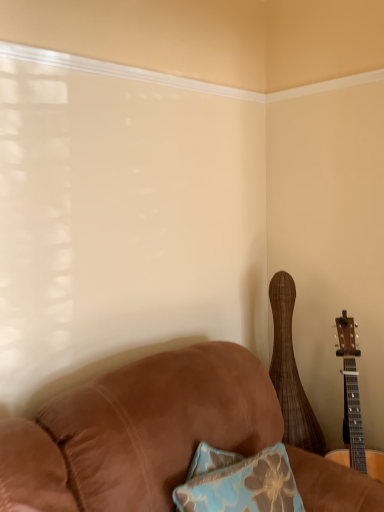
The width and height of the screenshot is (384, 512). What do you see at coordinates (290, 371) in the screenshot? I see `wooden acoustic guitar at right, which appears as the first guitar when viewed from the left` at bounding box center [290, 371].

This screenshot has width=384, height=512. I want to click on wooden acoustic guitar at right, which is the second guitar from right to left, so click(x=290, y=371).

In order to click on natural wood acoustic guitar at right, marked as the 1th guitar in a right-to-left arrangement in this screenshot , I will do `click(353, 407)`.

In order to face natural wood acoustic guitar at right, marked as the 1th guitar in a right-to-left arrangement, should I rotate leftwards or rightwards?

It's best to rotate right around 21.680 degrees.

The height and width of the screenshot is (512, 384). What do you see at coordinates (353, 407) in the screenshot? I see `natural wood acoustic guitar at right, positioned as the 2th guitar in left-to-right order` at bounding box center [353, 407].

Locate an element on the screen. wooden acoustic guitar at right, which is the second guitar from right to left is located at coordinates click(290, 371).

Can you confirm if wooden acoustic guitar at right, which appears as the first guitar when viewed from the left, is positioned to the left of natural wood acoustic guitar at right, positioned as the 2th guitar in left-to-right order?

Yes, wooden acoustic guitar at right, which appears as the first guitar when viewed from the left, is to the left of natural wood acoustic guitar at right, positioned as the 2th guitar in left-to-right order.

From the picture: Between wooden acoustic guitar at right, which appears as the first guitar when viewed from the left, and natural wood acoustic guitar at right, marked as the 1th guitar in a right-to-left arrangement, which one is positioned behind?

wooden acoustic guitar at right, which appears as the first guitar when viewed from the left.

Does point (275, 379) come farther from viewer compared to point (379, 472)?

Yes.

From the image's perspective, is wooden acoustic guitar at right, which is the second guitar from right to left, on top of natural wood acoustic guitar at right, positioned as the 2th guitar in left-to-right order?

Yes, from the image's perspective, wooden acoustic guitar at right, which is the second guitar from right to left, is above natural wood acoustic guitar at right, positioned as the 2th guitar in left-to-right order.

From a real-world perspective, is wooden acoustic guitar at right, which is the second guitar from right to left, on natural wood acoustic guitar at right, positioned as the 2th guitar in left-to-right order?

Yes, from a real-world perspective, wooden acoustic guitar at right, which is the second guitar from right to left, is on top of natural wood acoustic guitar at right, positioned as the 2th guitar in left-to-right order.

Can you confirm if wooden acoustic guitar at right, which is the second guitar from right to left, is wider than natural wood acoustic guitar at right, positioned as the 2th guitar in left-to-right order?

Incorrect, the width of wooden acoustic guitar at right, which is the second guitar from right to left, does not surpass that of natural wood acoustic guitar at right, positioned as the 2th guitar in left-to-right order.

Consider the image. Which of these two, wooden acoustic guitar at right, which is the second guitar from right to left, or natural wood acoustic guitar at right, positioned as the 2th guitar in left-to-right order, stands taller?

wooden acoustic guitar at right, which is the second guitar from right to left, is taller.

Is wooden acoustic guitar at right, which appears as the first guitar when viewed from the left, smaller than natural wood acoustic guitar at right, marked as the 1th guitar in a right-to-left arrangement?

Yes.

Could natural wood acoustic guitar at right, positioned as the 2th guitar in left-to-right order, be considered to be inside wooden acoustic guitar at right, which appears as the first guitar when viewed from the left?

Actually, natural wood acoustic guitar at right, positioned as the 2th guitar in left-to-right order, is outside wooden acoustic guitar at right, which appears as the first guitar when viewed from the left.

Is wooden acoustic guitar at right, which is the second guitar from right to left, beside natural wood acoustic guitar at right, marked as the 1th guitar in a right-to-left arrangement?

wooden acoustic guitar at right, which is the second guitar from right to left, and natural wood acoustic guitar at right, marked as the 1th guitar in a right-to-left arrangement, are clearly separated.

Based on the photo, is wooden acoustic guitar at right, which appears as the first guitar when viewed from the left, facing away from natural wood acoustic guitar at right, marked as the 1th guitar in a right-to-left arrangement?

Yes, natural wood acoustic guitar at right, marked as the 1th guitar in a right-to-left arrangement, is at the back of wooden acoustic guitar at right, which appears as the first guitar when viewed from the left.

This screenshot has width=384, height=512. In order to click on guitar to the left of natural wood acoustic guitar at right, marked as the 1th guitar in a right-to-left arrangement in this screenshot , I will do [x=290, y=371].

Which is more to the left, natural wood acoustic guitar at right, marked as the 1th guitar in a right-to-left arrangement, or wooden acoustic guitar at right, which appears as the first guitar when viewed from the left?

wooden acoustic guitar at right, which appears as the first guitar when viewed from the left, is more to the left.

Based on the photo, in the image, is natural wood acoustic guitar at right, positioned as the 2th guitar in left-to-right order, positioned in front of or behind wooden acoustic guitar at right, which is the second guitar from right to left?

natural wood acoustic guitar at right, positioned as the 2th guitar in left-to-right order, is in front of wooden acoustic guitar at right, which is the second guitar from right to left.

Between point (343, 420) and point (277, 334), which one is positioned behind?

The point (343, 420) is farther from the camera.

From the image's perspective, which one is positioned lower, natural wood acoustic guitar at right, positioned as the 2th guitar in left-to-right order, or wooden acoustic guitar at right, which appears as the first guitar when viewed from the left?

natural wood acoustic guitar at right, positioned as the 2th guitar in left-to-right order, from the image's perspective.

From a real-world perspective, is natural wood acoustic guitar at right, marked as the 1th guitar in a right-to-left arrangement, positioned over wooden acoustic guitar at right, which is the second guitar from right to left, based on gravity?

Incorrect, from a real-world perspective, natural wood acoustic guitar at right, marked as the 1th guitar in a right-to-left arrangement, is lower than wooden acoustic guitar at right, which is the second guitar from right to left.

Considering the relative sizes of natural wood acoustic guitar at right, positioned as the 2th guitar in left-to-right order, and wooden acoustic guitar at right, which appears as the first guitar when viewed from the left, in the image provided, is natural wood acoustic guitar at right, positioned as the 2th guitar in left-to-right order, wider than wooden acoustic guitar at right, which appears as the first guitar when viewed from the left,?

Indeed, natural wood acoustic guitar at right, positioned as the 2th guitar in left-to-right order, has a greater width compared to wooden acoustic guitar at right, which appears as the first guitar when viewed from the left.

Is natural wood acoustic guitar at right, positioned as the 2th guitar in left-to-right order, shorter than wooden acoustic guitar at right, which is the second guitar from right to left?

Yes, natural wood acoustic guitar at right, positioned as the 2th guitar in left-to-right order, is shorter than wooden acoustic guitar at right, which is the second guitar from right to left.

Who is smaller, natural wood acoustic guitar at right, positioned as the 2th guitar in left-to-right order, or wooden acoustic guitar at right, which appears as the first guitar when viewed from the left?

wooden acoustic guitar at right, which appears as the first guitar when viewed from the left, is smaller.

Would you say natural wood acoustic guitar at right, positioned as the 2th guitar in left-to-right order, contains wooden acoustic guitar at right, which is the second guitar from right to left?

Answer: Actually, wooden acoustic guitar at right, which is the second guitar from right to left, is outside natural wood acoustic guitar at right, positioned as the 2th guitar in left-to-right order.

Can you see natural wood acoustic guitar at right, marked as the 1th guitar in a right-to-left arrangement, touching wooden acoustic guitar at right, which is the second guitar from right to left?

No, natural wood acoustic guitar at right, marked as the 1th guitar in a right-to-left arrangement, is not touching wooden acoustic guitar at right, which is the second guitar from right to left.

Consider the image. Is natural wood acoustic guitar at right, marked as the 1th guitar in a right-to-left arrangement, positioned with its back to wooden acoustic guitar at right, which is the second guitar from right to left?

Yes, natural wood acoustic guitar at right, marked as the 1th guitar in a right-to-left arrangement, is facing away from wooden acoustic guitar at right, which is the second guitar from right to left.

How much distance is there between natural wood acoustic guitar at right, positioned as the 2th guitar in left-to-right order, and wooden acoustic guitar at right, which is the second guitar from right to left?

The distance of natural wood acoustic guitar at right, positioned as the 2th guitar in left-to-right order, from wooden acoustic guitar at right, which is the second guitar from right to left, is 9.87 inches.

This screenshot has width=384, height=512. I want to click on guitar behind the natural wood acoustic guitar at right, positioned as the 2th guitar in left-to-right order, so click(290, 371).

Where is `guitar below the wooden acoustic guitar at right, which appears as the first guitar when viewed from the left (from a real-world perspective)`? guitar below the wooden acoustic guitar at right, which appears as the first guitar when viewed from the left (from a real-world perspective) is located at coordinates (353, 407).

You are a GUI agent. You are given a task and a screenshot of the screen. Output one action in this format:
    pyautogui.click(x=<x>, y=<y>)
    Task: Click on the guitar on the right of wooden acoustic guitar at right, which is the second guitar from right to left
    
    Given the screenshot: What is the action you would take?
    pyautogui.click(x=353, y=407)